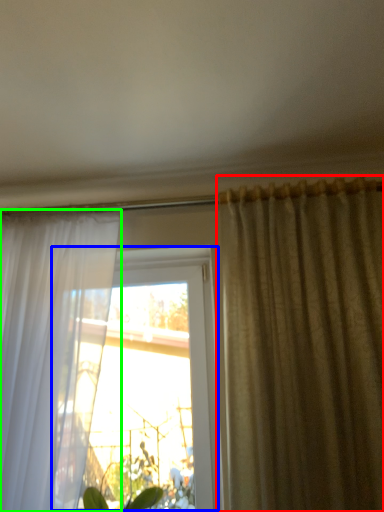
Question: Considering the real-world distances, which object is farthest from curtain (highlighted by a red box)? window (highlighted by a blue box) or curtain (highlighted by a green box)?

Choices:
 (A) window
 (B) curtain

Answer: (B)